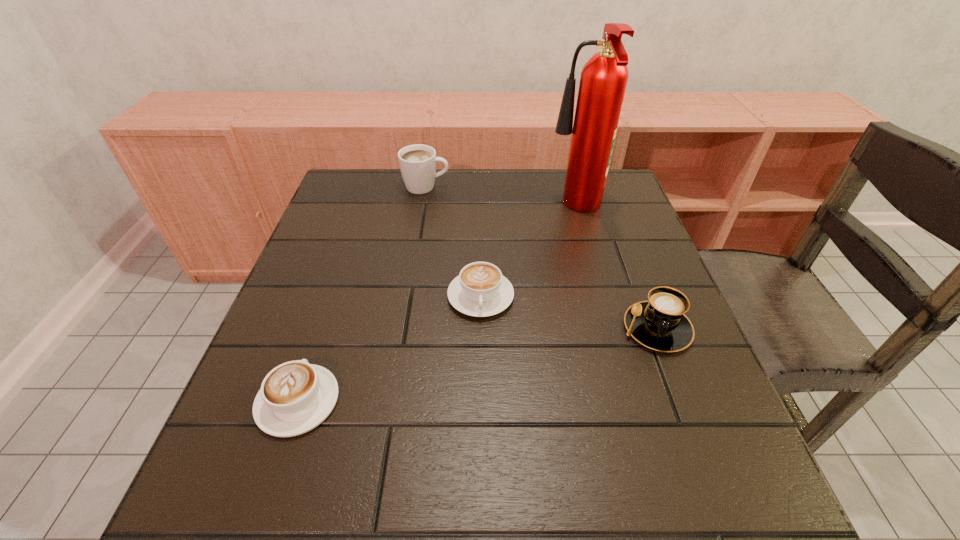
The image size is (960, 540). I want to click on the tallest object, so click(x=603, y=80).

Where is `the farthest cappuccino`? Image resolution: width=960 pixels, height=540 pixels. the farthest cappuccino is located at coordinates (417, 162).

Locate an element on the screen. The width and height of the screenshot is (960, 540). the fourth shortest object is located at coordinates (417, 162).

The image size is (960, 540). Identify the location of the third shortest object. click(660, 323).

Find the location of a particular element. Image resolution: width=960 pixels, height=540 pixels. the rightmost cappuccino is located at coordinates (660, 323).

You are a GUI agent. You are given a task and a screenshot of the screen. Output one action in this format:
    pyautogui.click(x=<x>, y=<y>)
    Task: Click on the third object from left to right
    The width and height of the screenshot is (960, 540).
    Given the screenshot: What is the action you would take?
    480,290

You are a GUI agent. You are given a task and a screenshot of the screen. Output one action in this format:
    pyautogui.click(x=<x>, y=<y>)
    Task: Click on the nearest object
    
    Given the screenshot: What is the action you would take?
    pyautogui.click(x=295, y=397)

Find the location of `the leftmost cappuccino`. the leftmost cappuccino is located at coordinates coord(295,397).

The width and height of the screenshot is (960, 540). What are the coordinates of `vacant space located at the nozzle of the fire extinguisher` in the screenshot? It's located at (487, 209).

The height and width of the screenshot is (540, 960). What are the coordinates of `free space located 0.140m at the nozzle of the fire extinguisher` in the screenshot? It's located at (497, 209).